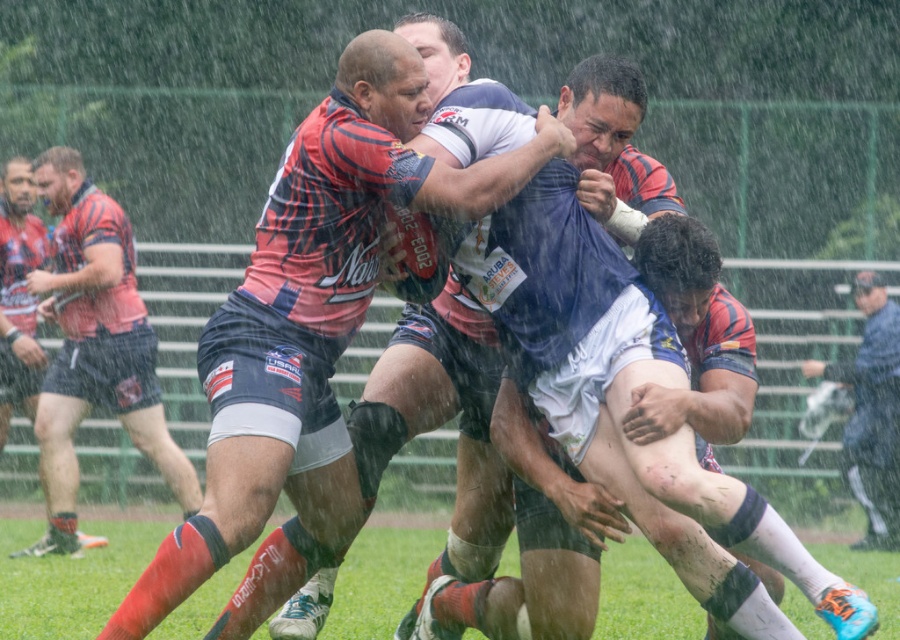
Which is above, matte red and blue rugby jersey at center or blue fabric umbrella at right?

Positioned higher is matte red and blue rugby jersey at center.

Between matte red and blue rugby jersey at center and blue fabric umbrella at right, which one appears on the right side from the viewer's perspective?

From the viewer's perspective, blue fabric umbrella at right appears more on the right side.

Measure the distance between matte red and blue rugby jersey at center and camera.

The distance of matte red and blue rugby jersey at center from camera is 16.99 feet.

Image resolution: width=900 pixels, height=640 pixels. Find the location of `matte red and blue rugby jersey at center`. matte red and blue rugby jersey at center is located at coordinates (312, 317).

Who is positioned more to the left, matte red shirt at left or blue fabric umbrella at right?

Positioned to the left is matte red shirt at left.

Can you confirm if matte red shirt at left is bigger than blue fabric umbrella at right?

Indeed, matte red shirt at left has a larger size compared to blue fabric umbrella at right.

Between point (60, 356) and point (851, 364), which one is positioned behind?

Positioned behind is point (851, 364).

The height and width of the screenshot is (640, 900). Find the location of `matte red shirt at left`. matte red shirt at left is located at coordinates (94, 346).

Is matte red and blue rugby jersey at center shorter than matte red shirt at left?

Yes, matte red and blue rugby jersey at center is shorter than matte red shirt at left.

The width and height of the screenshot is (900, 640). What are the coordinates of `matte red and blue rugby jersey at center` in the screenshot? It's located at (312, 317).